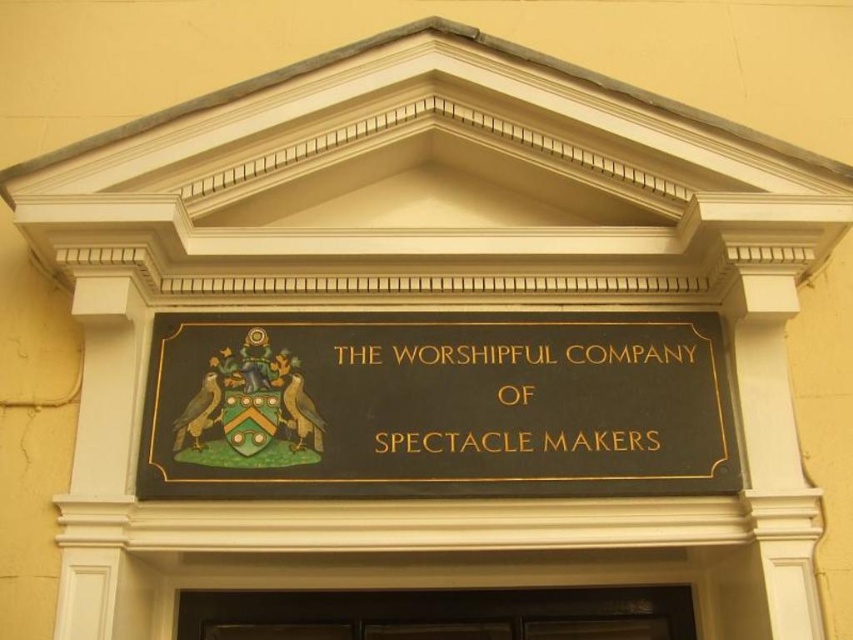
Question: Does black polished wood sign at center have a smaller size compared to goldmaterial/texturetext at center?

Choices:
 (A) no
 (B) yes

Answer: (A)

Question: Which object is closer to the camera taking this photo?

Choices:
 (A) black polished wood sign at center
 (B) black wood door at center

Answer: (A)

Question: Estimate the real-world distances between objects in this image. Which object is farther from the goldmaterial/texturetext at center?

Choices:
 (A) black polished wood sign at center
 (B) black wood door at center

Answer: (B)

Question: Which point appears farthest from the camera in this image?

Choices:
 (A) (341, 413)
 (B) (575, 376)
 (C) (503, 616)

Answer: (C)

Question: Is black polished wood sign at center wider than goldmaterial/texturetext at center?

Choices:
 (A) no
 (B) yes

Answer: (B)

Question: Can you confirm if black polished wood sign at center is wider than goldmaterial/texturetext at center?

Choices:
 (A) no
 (B) yes

Answer: (B)